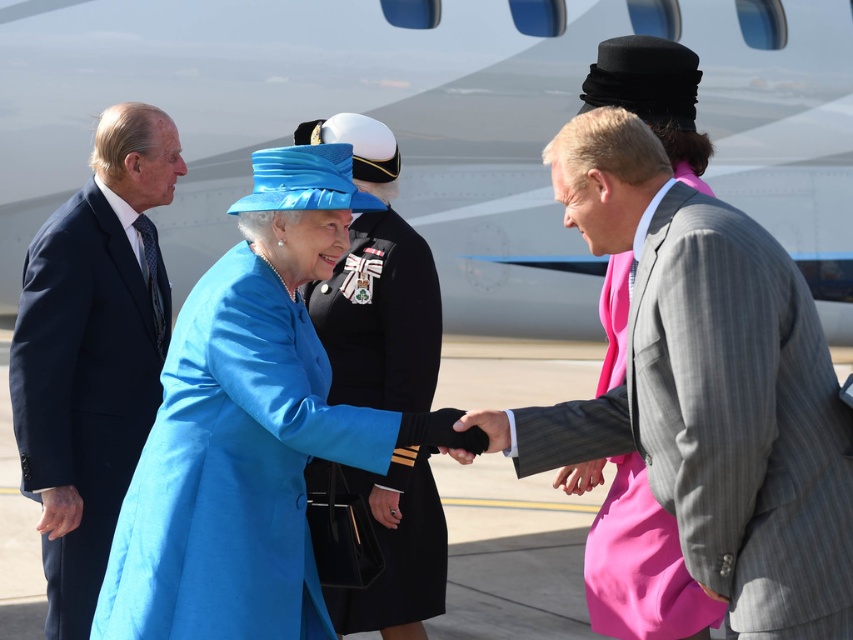
Based on the scene description, what are the coordinates of the gray pinstripe suit at center?

The gray pinstripe suit at center is located at coordinates point (706, 388).

You are a photographer positioned at the back of the scene. You want to take a photo of the satin blue coat at center and the navy blue suit at left. Which one will appear larger in your photo?

The satin blue coat at center will appear larger in the photo because it is closer to the viewer than the navy blue suit at left.